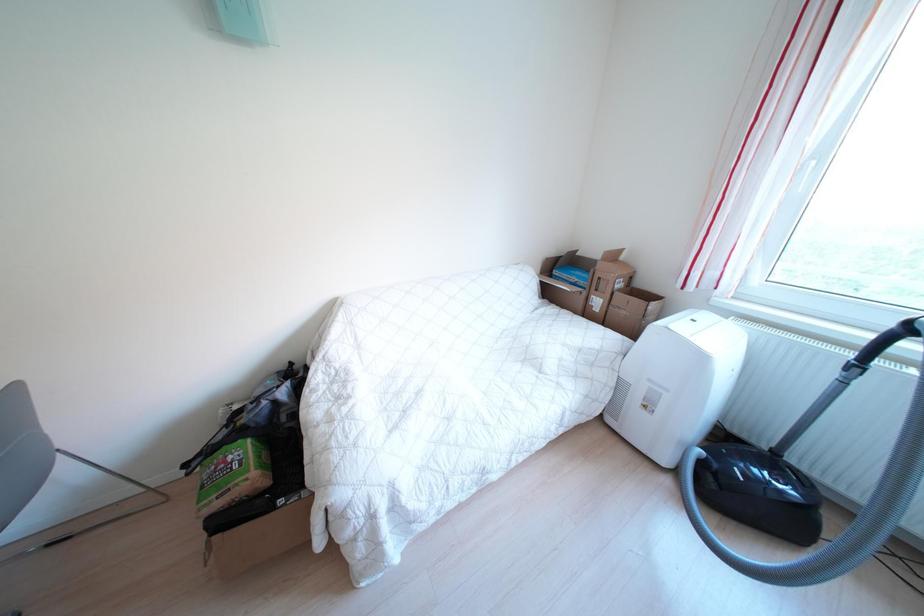
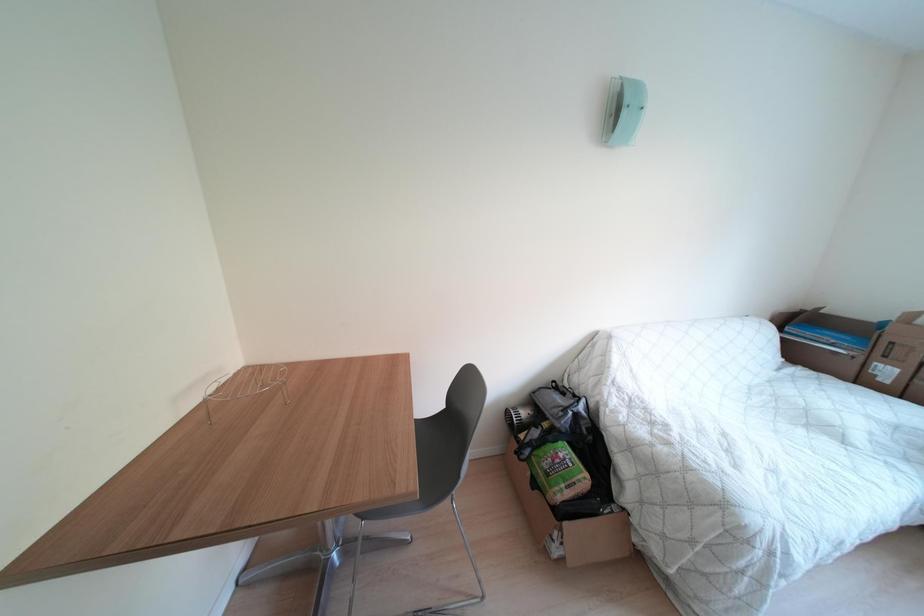
Question: The images are taken continuously from a first-person perspective. In which direction are you moving?

Choices:
 (A) Left
 (B) Right
 (C) Forward
 (D) Backward

Answer: (A)